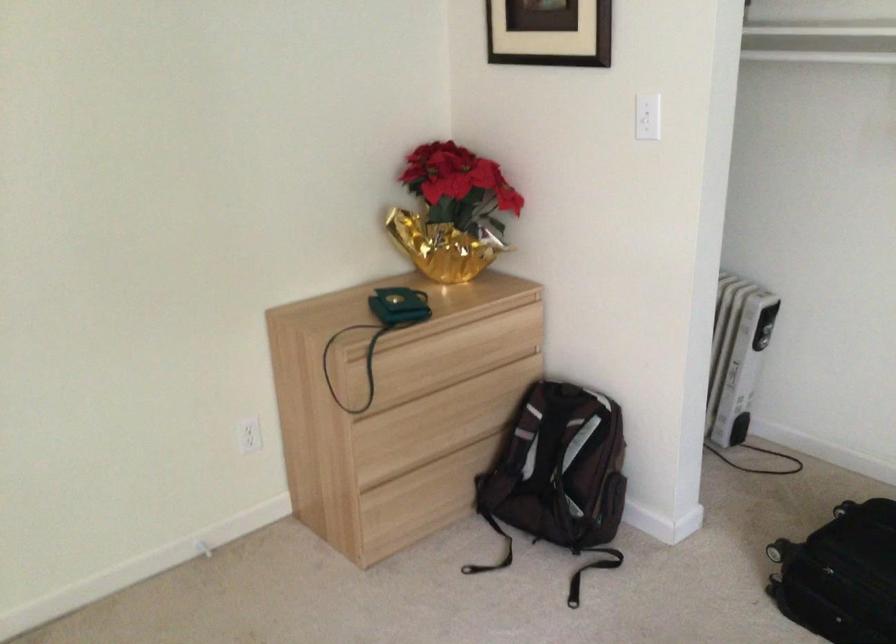
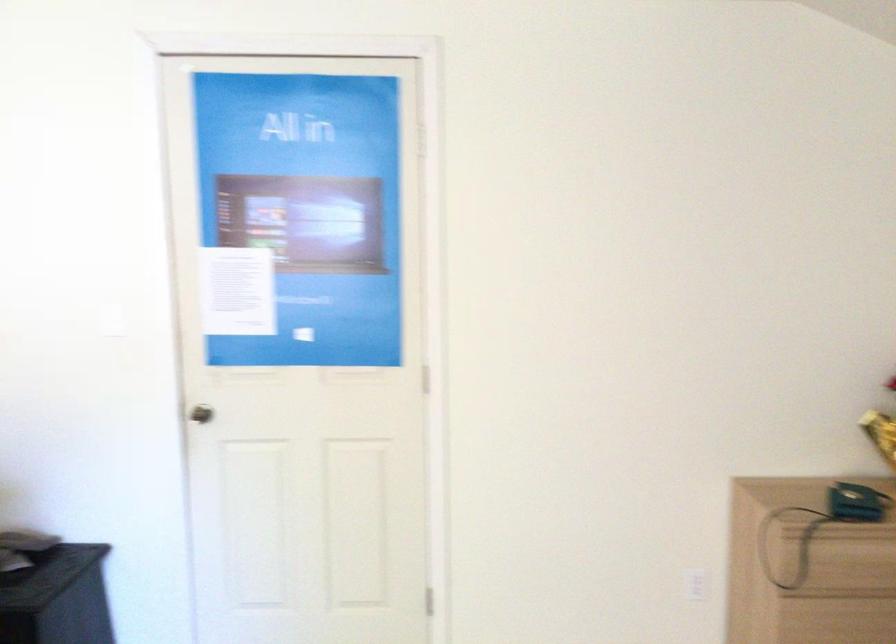
Question: The camera is either moving clockwise (left) or counter-clockwise (right) around the object. The first image is from the beginning of the video and the second image is from the end. Is the camera moving left or right when shooting the video?

Choices:
 (A) Left
 (B) Right

Answer: (B)